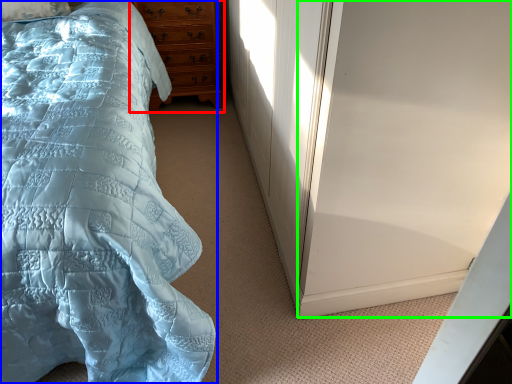
Question: Considering the real-world distances, which object is closest to chest of drawers (highlighted by a red box)? bed (highlighted by a blue box) or screen door (highlighted by a green box).

Choices:
 (A) bed
 (B) screen door

Answer: (A)